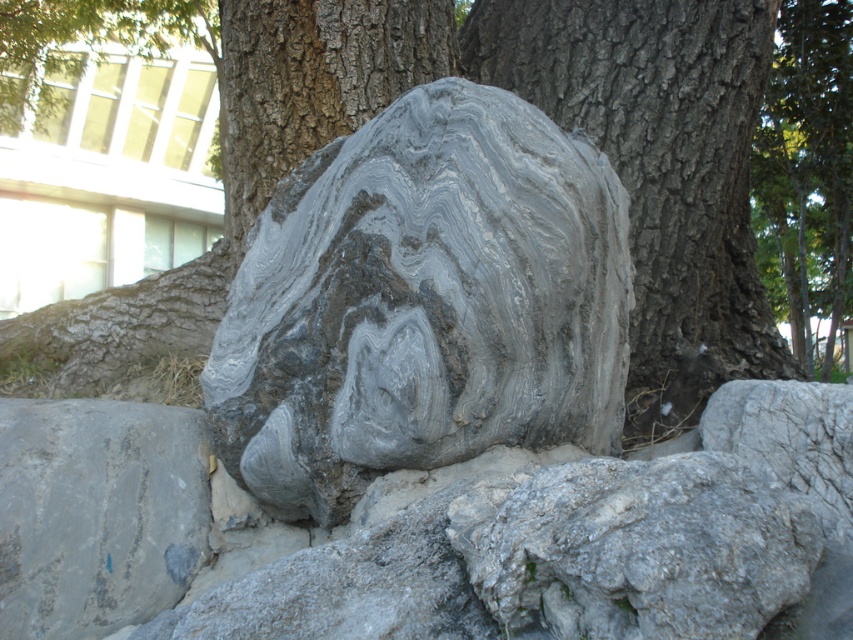
You are standing in the natural scene described. You need to place a small potted plant exactly at the coordinates given for the gray marble rock at center. Is the spot suitable for placing the plant?

The gray marble rock at center is located at point (560,124), so placing the potted plant there would require removing the rock first since they cannot occupy the same space.

You are standing in a garden and want to take a photo of both the marble sculpture at center and the gray rough rock at center. Which object should you focus on first to ensure both are in the frame?

You should focus on the marble sculpture at center first because it is closer to you than the gray rough rock at center, ensuring both are in the frame.